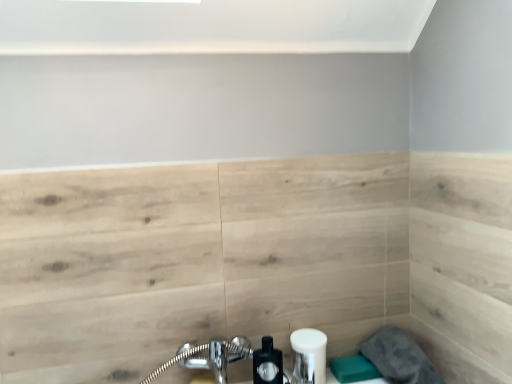
Question: Is gray fabric towel at lower right to the right of matte black soap dispenser at lower center from the viewer's perspective?

Choices:
 (A) no
 (B) yes

Answer: (B)

Question: Could you tell me if gray fabric towel at lower right is turned towards matte black soap dispenser at lower center?

Choices:
 (A) yes
 (B) no

Answer: (B)

Question: Is gray fabric towel at lower right positioned beyond the bounds of matte black soap dispenser at lower center?

Choices:
 (A) yes
 (B) no

Answer: (A)

Question: Can you confirm if gray fabric towel at lower right is smaller than matte black soap dispenser at lower center?

Choices:
 (A) yes
 (B) no

Answer: (B)

Question: Does gray fabric towel at lower right appear on the left side of matte black soap dispenser at lower center?

Choices:
 (A) yes
 (B) no

Answer: (B)

Question: Considering the positions of matte black soap dispenser at lower center and gray fabric towel at lower right in the image, is matte black soap dispenser at lower center bigger or smaller than gray fabric towel at lower right?

Choices:
 (A) big
 (B) small

Answer: (B)

Question: Is matte black soap dispenser at lower center to the left or to the right of gray fabric towel at lower right in the image?

Choices:
 (A) right
 (B) left

Answer: (B)

Question: From a real-world perspective, is matte black soap dispenser at lower center physically located above or below gray fabric towel at lower right?

Choices:
 (A) below
 (B) above

Answer: (B)

Question: Is matte black soap dispenser at lower center wider or thinner than gray fabric towel at lower right?

Choices:
 (A) wide
 (B) thin

Answer: (B)

Question: Considering the positions of white matte soap dispenser at lower center and matte black soap dispenser at lower center in the image, is white matte soap dispenser at lower center wider or thinner than matte black soap dispenser at lower center?

Choices:
 (A) thin
 (B) wide

Answer: (B)

Question: Considering the positions of white matte soap dispenser at lower center and matte black soap dispenser at lower center in the image, is white matte soap dispenser at lower center taller or shorter than matte black soap dispenser at lower center?

Choices:
 (A) tall
 (B) short

Answer: (B)

Question: Considering their positions, is white matte soap dispenser at lower center located in front of or behind matte black soap dispenser at lower center?

Choices:
 (A) front
 (B) behind

Answer: (B)

Question: Is point (295, 364) closer or farther from the camera than point (265, 364)?

Choices:
 (A) closer
 (B) farther

Answer: (B)

Question: From the image's perspective, relative to white matte soap dispenser at lower center, is gray fabric towel at lower right above or below?

Choices:
 (A) above
 (B) below

Answer: (B)

Question: Considering the relative positions of gray fabric towel at lower right and white matte soap dispenser at lower center in the image provided, is gray fabric towel at lower right to the left or to the right of white matte soap dispenser at lower center?

Choices:
 (A) left
 (B) right

Answer: (B)